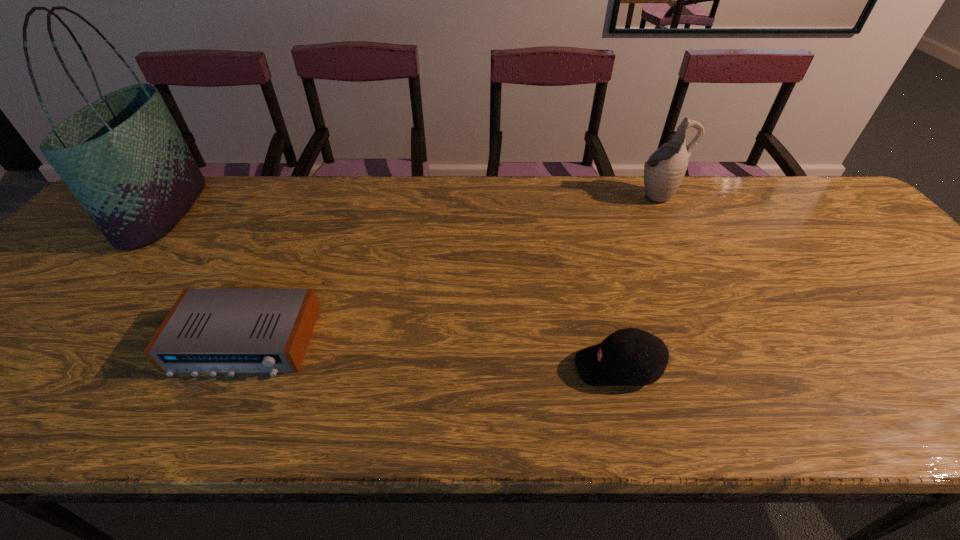
Locate an element on the screen. vacant area situated at the spout of the rightmost object is located at coordinates (604, 195).

The width and height of the screenshot is (960, 540). I want to click on free space located at the spout of the rightmost object, so click(x=547, y=195).

Where is `vacant space located 0.190m with a logo on the front of the second shortest object`? vacant space located 0.190m with a logo on the front of the second shortest object is located at coordinates (483, 367).

You are a GUI agent. You are given a task and a screenshot of the screen. Output one action in this format:
    pyautogui.click(x=<x>, y=<y>)
    Task: Click on the blank space located with a logo on the front of the second shortest object
    
    Given the screenshot: What is the action you would take?
    pyautogui.click(x=521, y=367)

Locate an element on the screen. The image size is (960, 540). vacant space located 0.050m with a logo on the front of the second shortest object is located at coordinates (551, 367).

The height and width of the screenshot is (540, 960). I want to click on vacant space situated 0.100m on the control panel of the radio receiver, so click(204, 426).

Image resolution: width=960 pixels, height=540 pixels. In order to click on tote bag at the far edge in this screenshot , I will do `click(123, 157)`.

The image size is (960, 540). Find the location of `pitcher positioned at the far edge`. pitcher positioned at the far edge is located at coordinates (664, 170).

Locate an element on the screen. object that is at the near edge is located at coordinates (628, 357).

Identify the location of object positioned at the left edge. (123, 157).